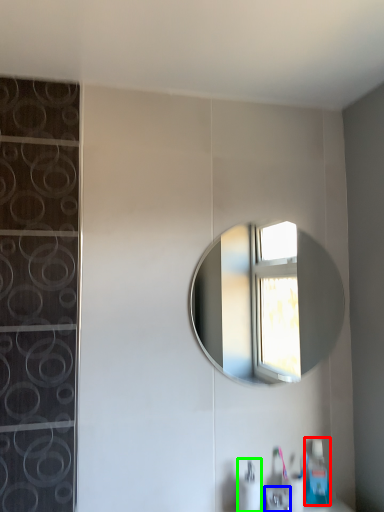
Question: Estimate the real-world distances between objects in this image. Which object is closer to soap dispenser (highlighted by a red box), faucet (highlighted by a blue box) or soap dispenser (highlighted by a green box)?

Choices:
 (A) faucet
 (B) soap dispenser

Answer: (A)